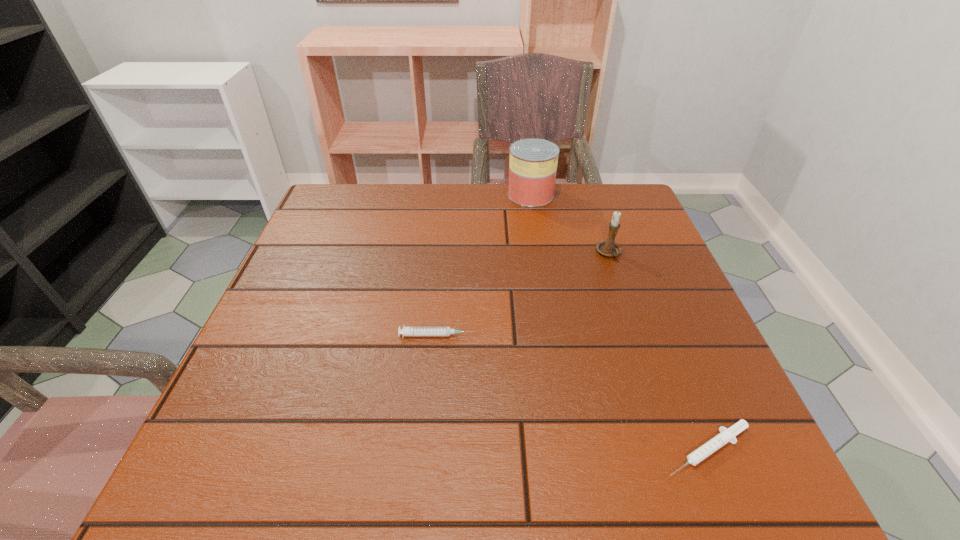
At what (x,y) coordinates should I click in order to perform the action: click on vacant space located 0.310m at the needle end of the left syringe. Please return your answer as a coordinate pair (x, y). The height and width of the screenshot is (540, 960). Looking at the image, I should click on (631, 335).

Where is `free space located 0.070m on the back of the right syringe`? free space located 0.070m on the back of the right syringe is located at coordinates (683, 387).

Find the location of a particular element. object that is positioned at the far edge is located at coordinates (533, 162).

Where is `object located at the near edge`? This screenshot has height=540, width=960. object located at the near edge is located at coordinates (726, 435).

You are a GUI agent. You are given a task and a screenshot of the screen. Output one action in this format:
    pyautogui.click(x=<x>, y=<y>)
    Task: Click on the candle holder situated at the right edge
    The height and width of the screenshot is (540, 960).
    Given the screenshot: What is the action you would take?
    pyautogui.click(x=609, y=248)

Image resolution: width=960 pixels, height=540 pixels. What are the coordinates of `syringe at the right edge` in the screenshot? It's located at (726, 435).

Identify the location of object that is at the near right corner. (726, 435).

Image resolution: width=960 pixels, height=540 pixels. I want to click on vacant space at the far edge of the desktop, so click(542, 214).

Identify the location of blank space at the near edge of the desktop. Image resolution: width=960 pixels, height=540 pixels. click(x=643, y=480).

Where is `free space at the left edge`? The height and width of the screenshot is (540, 960). free space at the left edge is located at coordinates (314, 266).